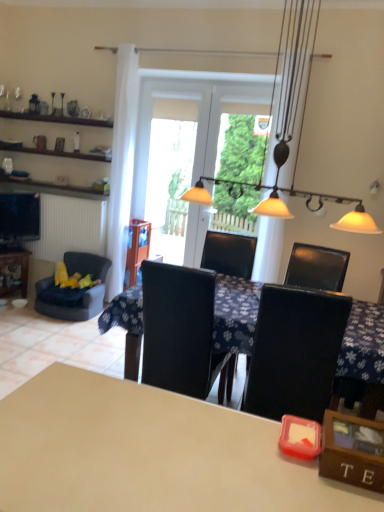
The width and height of the screenshot is (384, 512). What do you see at coordinates (352, 217) in the screenshot?
I see `metallic pendant lights at center` at bounding box center [352, 217].

The image size is (384, 512). What do you see at coordinates (150, 127) in the screenshot?
I see `transparent glass door at center, which is the second screen door from right to left` at bounding box center [150, 127].

How much space does transparent glass screen door at center, which is the 2th screen door in left-to-right order, occupy vertically?

It is 6.41 feet.

Locate an element on the screen. metallic pendant lights at center is located at coordinates (352, 217).

Is beige matte table at center, which is counted as the third table, starting from the back, closer to the viewer compared to metallic pendant lights at center?

Yes.

Based on the photo, considering the relative positions of beige matte table at center, which is the first table in front-to-back order, and metallic pendant lights at center in the image provided, is beige matte table at center, which is the first table in front-to-back order, to the left of metallic pendant lights at center from the viewer's perspective?

Yes, beige matte table at center, which is the first table in front-to-back order, is to the left of metallic pendant lights at center.

Looking at the image, does beige matte table at center, acting as the second table starting from the right, seem bigger or smaller compared to metallic pendant lights at center?

beige matte table at center, acting as the second table starting from the right, is smaller than metallic pendant lights at center.

From a real-world perspective, is beige matte table at center, which is counted as the third table, starting from the back, above or below metallic pendant lights at center?

beige matte table at center, which is counted as the third table, starting from the back, is situated lower than metallic pendant lights at center in the real world.

Is white glossy table at center, the first table when ordered from right to left, facing away from transparent glass door at center, which is the first screen door from left to right?

white glossy table at center, the first table when ordered from right to left, does not have its back to transparent glass door at center, which is the first screen door from left to right.

Which object is further away from the camera, white glossy table at center, which is the 2th table in back-to-front order, or transparent glass door at center, which is the first screen door from left to right?

transparent glass door at center, which is the first screen door from left to right, is further away from the camera.

Does white glossy table at center, the first table when ordered from right to left, have a greater width compared to transparent glass door at center, which is the second screen door from right to left?

Indeed, white glossy table at center, the first table when ordered from right to left, has a greater width compared to transparent glass door at center, which is the second screen door from right to left.

Could you tell me if white sheer curtain at left is facing beige matte table at center, acting as the 2th table starting from the left?

No, white sheer curtain at left is not turned towards beige matte table at center, acting as the 2th table starting from the left.

Is point (117, 159) closer or farther from the camera than point (213, 486)?

Point (117, 159) appears to be farther away from the viewer than point (213, 486).

How much distance is there between white sheer curtain at left and beige matte table at center, which is counted as the third table, starting from the back?

The distance of white sheer curtain at left from beige matte table at center, which is counted as the third table, starting from the back, is 10.57 feet.

Considering the relative sizes of white sheer curtain at left and beige matte table at center, which is the first table in front-to-back order, in the image provided, is white sheer curtain at left taller than beige matte table at center, which is the first table in front-to-back order,?

Yes.

Based on the photo, considering the sizes of objects metallic pendant lights at center and velvet blue armchair at left in the image provided, who is thinner, metallic pendant lights at center or velvet blue armchair at left?

metallic pendant lights at center is thinner.

Does point (275, 211) appear closer or farther from the camera than point (81, 260)?

Point (275, 211).

Is metallic pendant lights at center aimed at velvet blue armchair at left?

No, metallic pendant lights at center is not facing towards velvet blue armchair at left.

Considering the sizes of wooden table at left, arranged as the first table when viewed from the left, and white sheer curtain at left in the image, is wooden table at left, arranged as the first table when viewed from the left, wider or thinner than white sheer curtain at left?

In the image, wooden table at left, arranged as the first table when viewed from the left, appears to be wider than white sheer curtain at left.

Would you say wooden table at left, which is the third table in front-to-back order, is to the left or to the right of white sheer curtain at left in the picture?

wooden table at left, which is the third table in front-to-back order, is positioned on white sheer curtain at left's left side.

Are wooden table at left, arranged as the first table when viewed from the left, and white sheer curtain at left beside each other?

wooden table at left, arranged as the first table when viewed from the left, and white sheer curtain at left are clearly separated.

From a real-world perspective, is wooden table at left, which is the third table in front-to-back order, on top of white sheer curtain at left?

No, from a real-world perspective, wooden table at left, which is the third table in front-to-back order, is not on top of white sheer curtain at left.

Is beige matte table at center, acting as the 2th table starting from the left, surrounding white sheer curtain at left?

No, beige matte table at center, acting as the 2th table starting from the left, does not contain white sheer curtain at left.

Is the surface of beige matte table at center, which is the first table in front-to-back order, in direct contact with white sheer curtain at left?

beige matte table at center, which is the first table in front-to-back order, and white sheer curtain at left are not in contact.

Which object is closer to the camera, beige matte table at center, which is the first table in front-to-back order, or white sheer curtain at left?

Positioned in front is beige matte table at center, which is the first table in front-to-back order.

Is point (192, 487) more distant than point (117, 79)?

That is False.

Between white sheer curtain at left and white glossy table at center, which is the 2th table in back-to-front order, which one has smaller width?

white sheer curtain at left is thinner.

From a real-world perspective, relative to white glossy table at center, the first table when ordered from right to left, is white sheer curtain at left vertically above or below?

Clearly, from a real-world perspective, white sheer curtain at left is above white glossy table at center, the first table when ordered from right to left.

From the image's perspective, would you say white sheer curtain at left is positioned over white glossy table at center, the first table when ordered from right to left?

Yes.

Is white glossy table at center, which is counted as the 2th table, starting from the front, at the back of white sheer curtain at left?

No, white sheer curtain at left's orientation is not away from white glossy table at center, which is counted as the 2th table, starting from the front.

From a real-world perspective, starting from the metallic pendant lights at center, which table is the 1st one below it? Please provide its 2D coordinates.

[(149, 452)]

From the image's perspective, count 2nd screen doors upward from the white glossy table at center, the first table when ordered from right to left, and point to it. Please provide its 2D coordinates.

[(150, 127)]

Looking at the image, which one is located closer to transparent glass door at center, which is the second screen door from right to left, white sheer curtain at left or metallic pendant lights at center?

Based on the image, white sheer curtain at left appears to be nearer to transparent glass door at center, which is the second screen door from right to left.

Which object lies further to the anchor point white sheer curtain at left, beige matte table at center, which is the first table in front-to-back order, or velvet blue armchair at left?

beige matte table at center, which is the first table in front-to-back order, lies further to white sheer curtain at left than the other object.

When comparing their distances from beige matte table at center, which is counted as the third table, starting from the back, does transparent glass door at center, which is the first screen door from left to right, or white sheer curtain at left seem closer?

The object closer to beige matte table at center, which is counted as the third table, starting from the back, is white sheer curtain at left.

From the image, which object appears to be nearer to white glossy table at center, which is counted as the 2th table, starting from the front, wooden table at left, arranged as the first table when viewed from the left, or white sheer curtain at left?

white sheer curtain at left is positioned closer to the anchor white glossy table at center, which is counted as the 2th table, starting from the front.

When comparing their distances from beige matte table at center, acting as the 2th table starting from the left, does velvet blue armchair at left or wooden table at left, which is the third table in front-to-back order, seem further?

wooden table at left, which is the third table in front-to-back order, is positioned further to the anchor beige matte table at center, acting as the 2th table starting from the left.

When comparing their distances from white glossy table at center, which is counted as the 2th table, starting from the front, does transparent glass door at center, which is the second screen door from right to left, or beige matte table at center, which is the first table in front-to-back order, seem closer?

beige matte table at center, which is the first table in front-to-back order, is closer to white glossy table at center, which is counted as the 2th table, starting from the front.

Based on their spatial positions, is beige matte table at center, which is counted as the third table, starting from the back, or transparent glass door at center, which is the first screen door from left to right, further from white glossy table at center, the first table when ordered from right to left?

Among the two, transparent glass door at center, which is the first screen door from left to right, is located further to white glossy table at center, the first table when ordered from right to left.

Looking at the image, which one is located closer to transparent glass door at center, which is the second screen door from right to left, transparent glass screen door at center, the 1th screen door in the right-to-left sequence, or white sheer curtain at left?

Among the two, transparent glass screen door at center, the 1th screen door in the right-to-left sequence, is located nearer to transparent glass door at center, which is the second screen door from right to left.

Find the location of `table positioned between beige matte table at center, acting as the second table starting from the right, and white sheer curtain at left from near to far`. table positioned between beige matte table at center, acting as the second table starting from the right, and white sheer curtain at left from near to far is located at coordinates (362, 359).

Where is `table between beige matte table at center, acting as the second table starting from the right, and transparent glass screen door at center, which is the 2th screen door in left-to-right order, in the front-back direction`? The height and width of the screenshot is (512, 384). table between beige matte table at center, acting as the second table starting from the right, and transparent glass screen door at center, which is the 2th screen door in left-to-right order, in the front-back direction is located at coordinates 362,359.

At what (x,y) coordinates should I click in order to perform the action: click on curtain between white glossy table at center, the first table when ordered from right to left, and wooden table at left, which is the third table in front-to-back order, along the z-axis. Please return your answer as a coordinate pair (x, y). Looking at the image, I should click on (122, 165).

Where is `curtain between beige matte table at center, which is counted as the third table, starting from the back, and wooden table at left, arranged as the first table when viewed from the left, along the z-axis`? The width and height of the screenshot is (384, 512). curtain between beige matte table at center, which is counted as the third table, starting from the back, and wooden table at left, arranged as the first table when viewed from the left, along the z-axis is located at coordinates (122, 165).